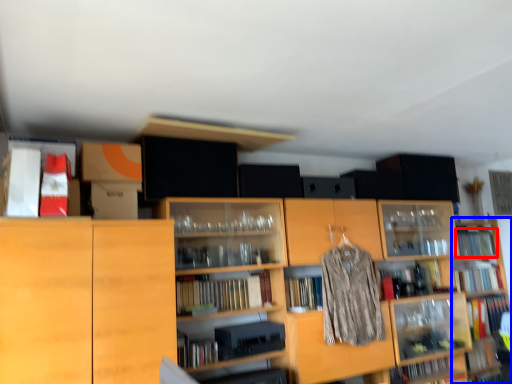
Question: Among these objects, which one is farthest to the camera, book (highlighted by a red box) or shelf (highlighted by a blue box)?

Choices:
 (A) book
 (B) shelf

Answer: (A)